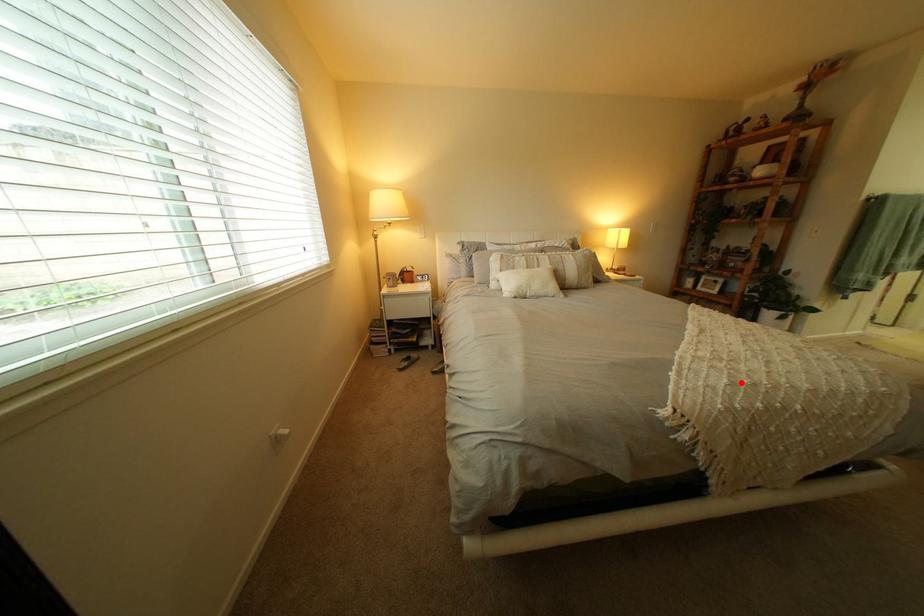
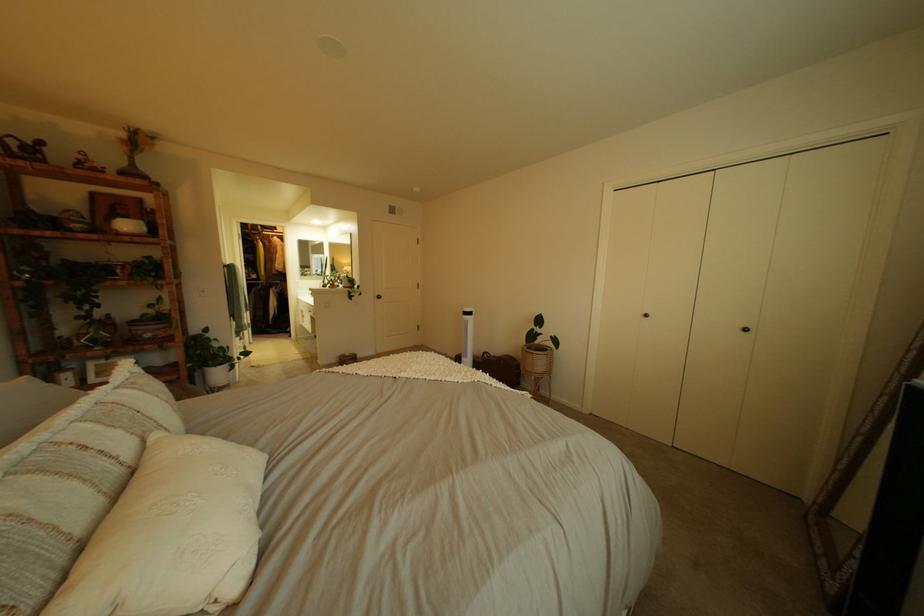
Locate, in the second image, the point that corresponds to the highlighted location in the first image.

(504, 376)